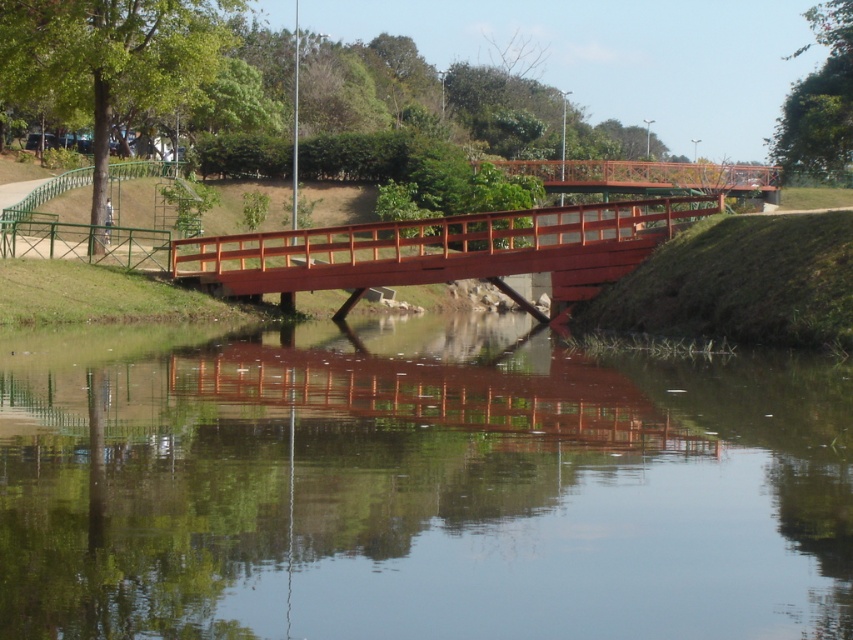
Question: Considering the real-world distances, which object is closest to the smooth wooden bridge at center?

Choices:
 (A) smooth brown water at center
 (B) rustic wood bridge at center

Answer: (A)

Question: Is smooth wooden bridge at center in front of rustic wood bridge at center?

Choices:
 (A) no
 (B) yes

Answer: (B)

Question: Which object is closer to the camera taking this photo?

Choices:
 (A) smooth brown water at center
 (B) smooth wooden bridge at center

Answer: (A)

Question: Does smooth brown water at center have a greater width compared to rustic wood bridge at center?

Choices:
 (A) no
 (B) yes

Answer: (A)

Question: Among these points, which one is nearest to the camera?

Choices:
 (A) (1, 564)
 (B) (741, 179)
 (C) (517, 212)

Answer: (A)

Question: Is smooth brown water at center bigger than rustic wood bridge at center?

Choices:
 (A) no
 (B) yes

Answer: (A)